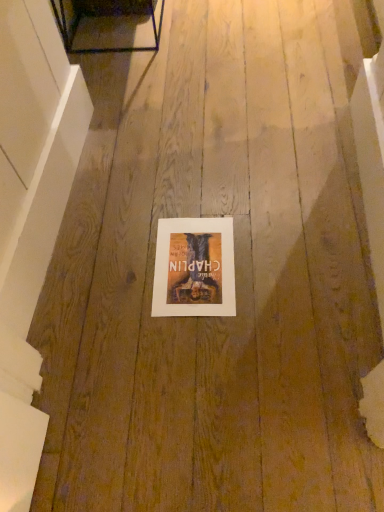
Locate an element on the screen. The height and width of the screenshot is (512, 384). free space above matte paper poster at center (from a real-world perspective) is located at coordinates (192, 258).